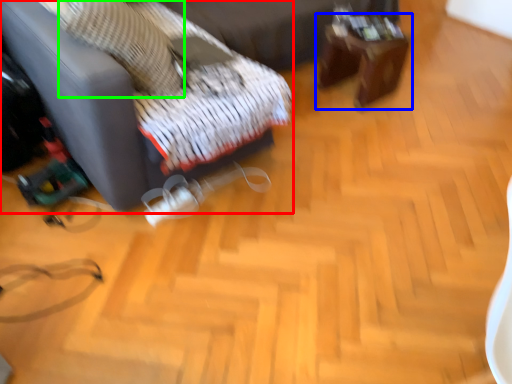
Question: Which object is positioned farthest from furniture (highlighted by a red box)? Select from table (highlighted by a blue box) and pillow (highlighted by a green box).

Choices:
 (A) table
 (B) pillow

Answer: (A)